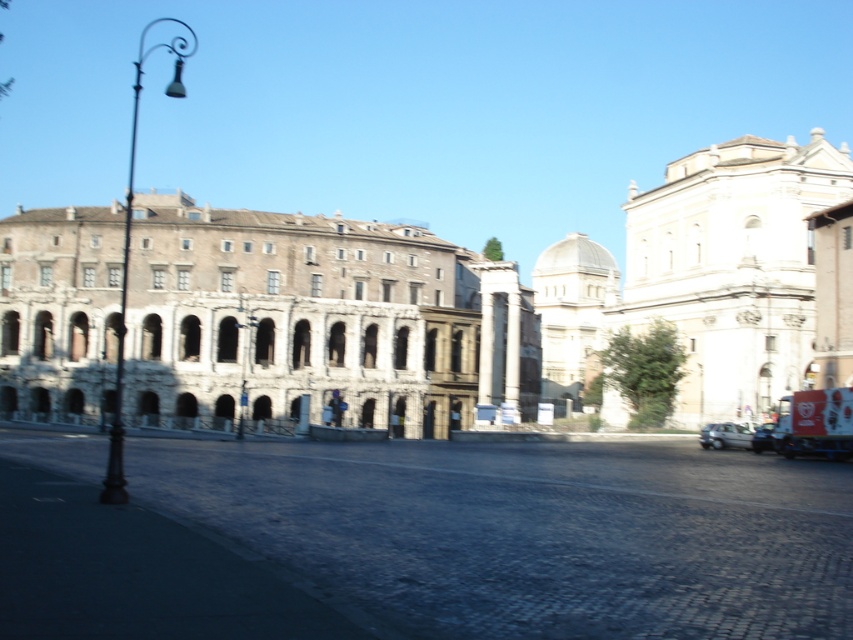
You are a delivery person needing to unload a package between the silver metallic car at lower right and the metallic silver car at lower right. Can you fit a 2.5 meter long loading ramp between them?

The distance between the silver metallic car at lower right and the metallic silver car at lower right is exactly 2.50 meters, so the 2.5 meter long loading ramp can fit between them with no space to spare.